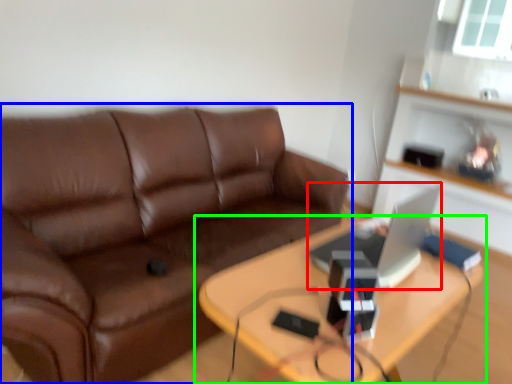
Question: Which is nearer to the computer (highlighted by a red box)? studio couch (highlighted by a blue box) or table (highlighted by a green box).

Choices:
 (A) studio couch
 (B) table

Answer: (B)